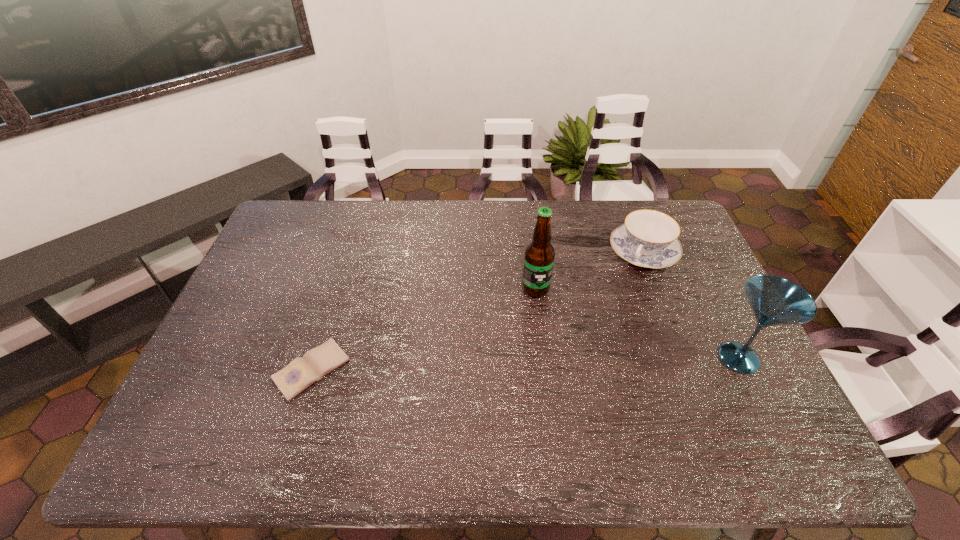
Where is `empty space between the diary and the second tallest object`? This screenshot has height=540, width=960. empty space between the diary and the second tallest object is located at coordinates (525, 364).

Locate an element on the screen. The height and width of the screenshot is (540, 960). vacant region between the third nearest object and the second tallest object is located at coordinates (637, 323).

Where is `free space between the shortest object and the farthest object`? free space between the shortest object and the farthest object is located at coordinates (477, 310).

Where is `vacant area between the second tallest object and the diary`? Image resolution: width=960 pixels, height=540 pixels. vacant area between the second tallest object and the diary is located at coordinates (525, 364).

Where is `vacant area between the chinaware and the leftmost object`? The width and height of the screenshot is (960, 540). vacant area between the chinaware and the leftmost object is located at coordinates (477, 310).

Select which object appears as the closest to the second tallest object. Please provide its 2D coordinates. Your answer should be formatted as a tuple, i.e. [(x, y)], where the tuple contains the x and y coordinates of a point satisfying the conditions above.

[(648, 239)]

Locate an element on the screen. This screenshot has height=540, width=960. object that ranks as the closest to the tallest object is located at coordinates (648, 239).

Find the location of a particular element. The height and width of the screenshot is (540, 960). free space that satisfies the following two spatial constraints: 1. on the back side of the second shortest object; 2. on the left side of the shortest object is located at coordinates (348, 252).